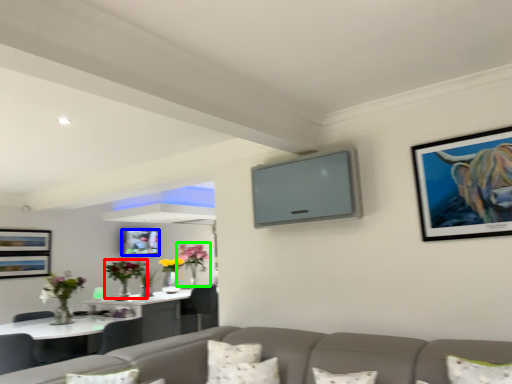
Question: Estimate the real-world distances between objects in this image. Which object is closer to floral arrangement (highlighted by a red box), picture frame (highlighted by a blue box) or floral arrangement (highlighted by a green box)?

Choices:
 (A) picture frame
 (B) floral arrangement

Answer: (A)